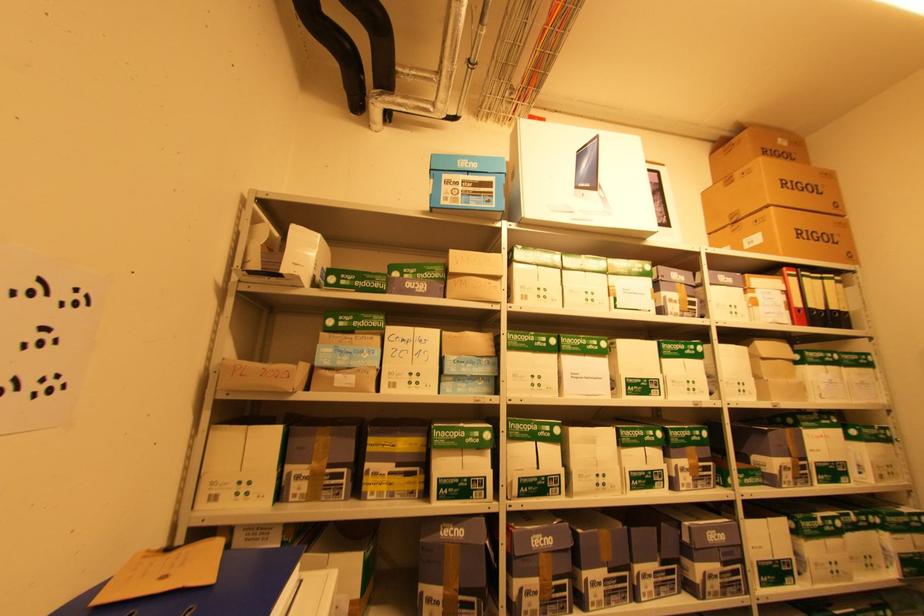
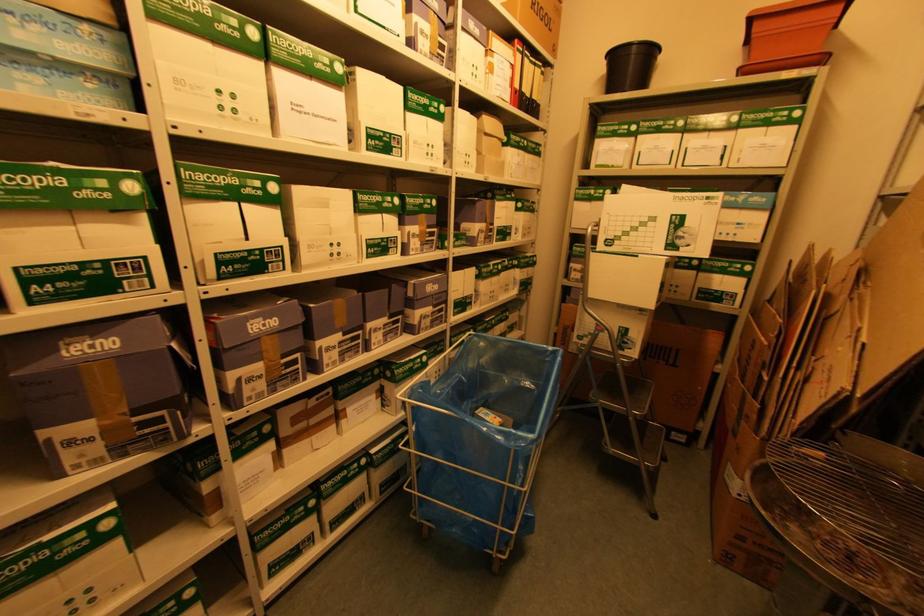
Based on the continuous images, in which direction is the camera rotating?

The rotation direction of the camera is right-down.